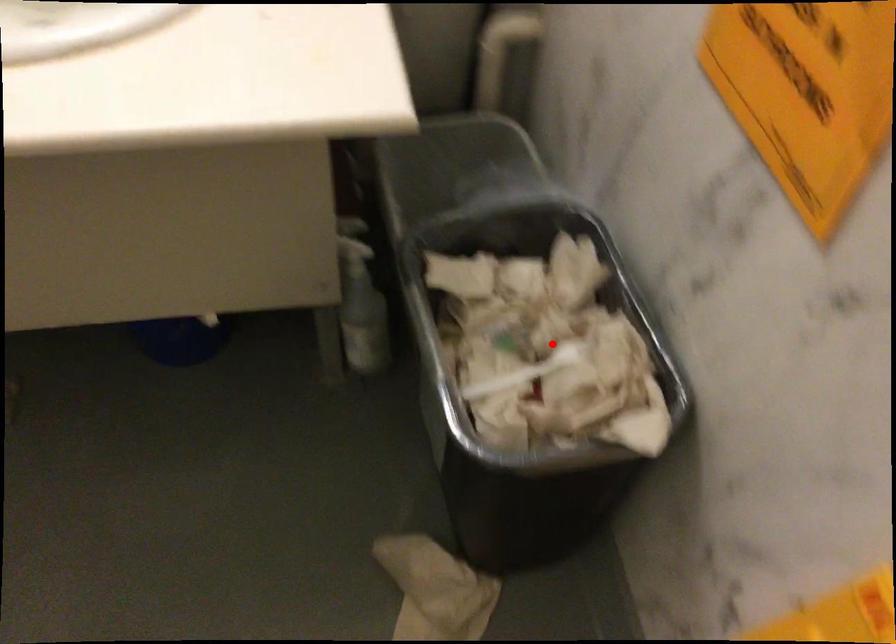
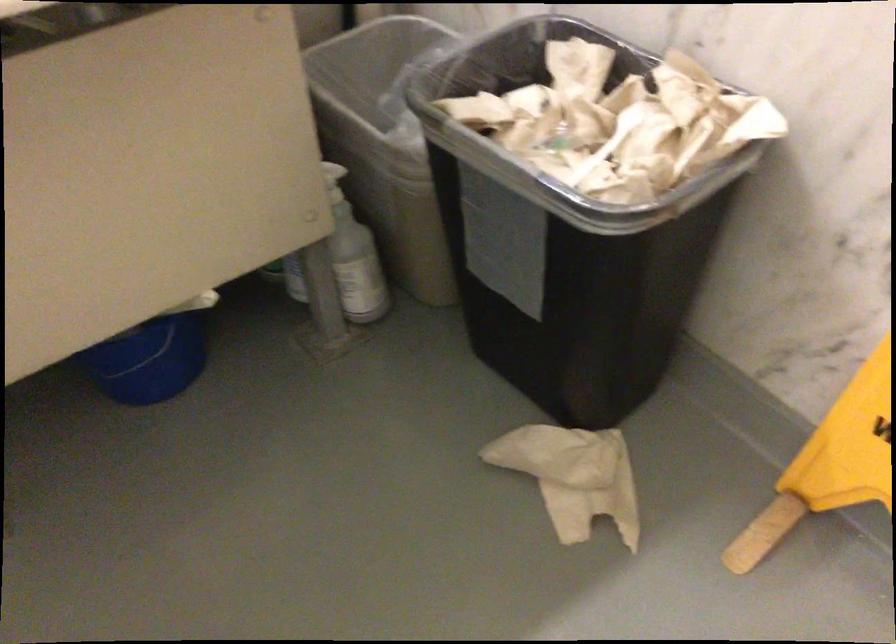
The point at the highlighted location is marked in the first image. Where is the corresponding point in the second image?

(618, 122)